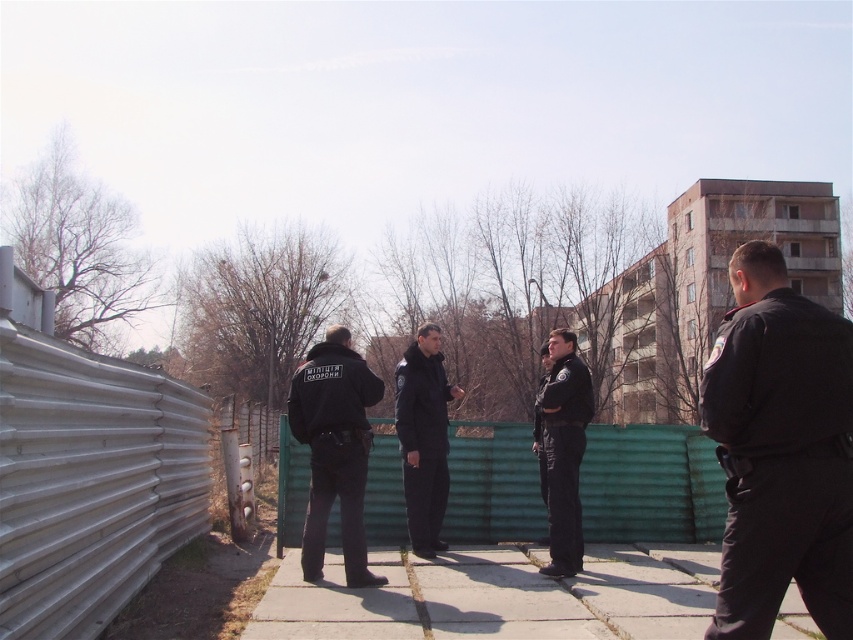
You are navigating a semi urban environment and need to reach the gray concrete pavement at center. Based on the coordinates provided, can you determine if it is positioned towards the upper or lower part of the image?

The gray concrete pavement at center is located at point (495, 596), which places it in the lower part of the image since the y coordinate is closer to 0.581. However, coordinates can vary depending on the system used, but typically in such contexts, lower y values correspond to lower positions. Since 0.581 is less than 0.933, it might be mid to lower part. Wait, actually, coordinates are usually given as x,y where the origin is at the bottom left or top left. If the origin is at the bottom left, then y 0

You are a photographer planning to capture a group photo of the black matte uniform at right and the green corrugated metal fence at center. If you want to ensure both subjects are fully visible in the frame, which subject should you position closer to the camera to avoid cropping?

You should position the black matte uniform at right closer to the camera because it is narrower than the green corrugated metal fence at center, allowing both to fit within the frame without cropping.

You are standing at the point closest to the corrugated metal wall. Looking towards the residential building, which of the two points, point (759, 516) or point (374, 492), is closer to you?

Point (759, 516) is closer to you because it is in front of point (374, 492).